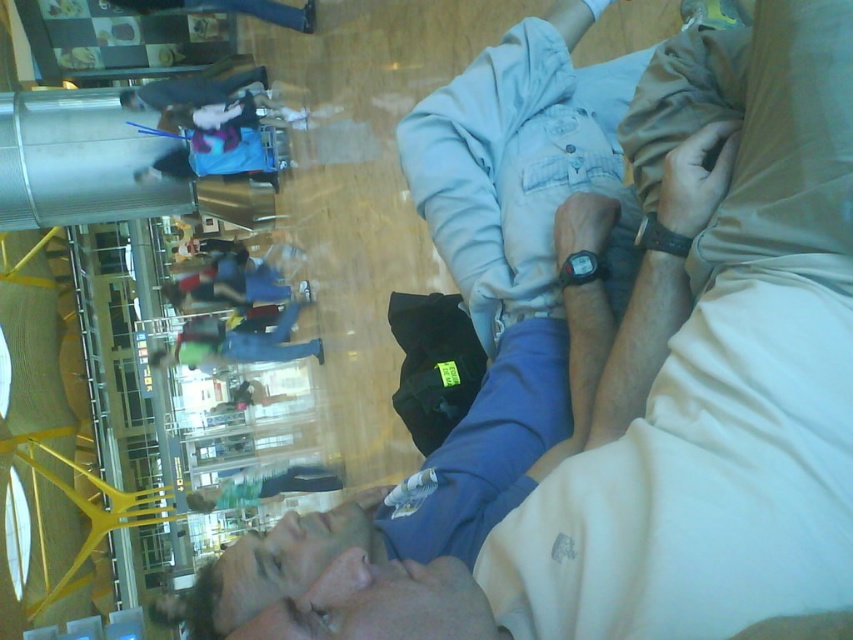
The height and width of the screenshot is (640, 853). What do you see at coordinates (689, 387) in the screenshot?
I see `light blue fabric at center` at bounding box center [689, 387].

Which is more to the left, light blue fabric at center or black leather watch at center?

Positioned to the left is light blue fabric at center.

At what (x,y) coordinates should I click in order to perform the action: click on light blue fabric at center. Please return your answer as a coordinate pair (x, y). Looking at the image, I should click on click(x=689, y=387).

Is point (682, 250) behind point (595, 252)?

No, it is in front of (595, 252).

Looking at this image, is black leather watch at center to the left of black plastic watch at center from the viewer's perspective?

Incorrect, black leather watch at center is not on the left side of black plastic watch at center.

Measure the distance between point (664,236) and camera.

They are 1.07 meters apart.

Locate an element on the screen. black leather watch at center is located at coordinates (660, 237).

Consider the image. Does light blue fabric at center appear under black plastic watch at center?

Yes.

Does point (804, 301) lie in front of point (590, 278)?

Yes, point (804, 301) is closer to viewer.

The height and width of the screenshot is (640, 853). Describe the element at coordinates (689, 387) in the screenshot. I see `light blue fabric at center` at that location.

Where is `light blue fabric at center`? light blue fabric at center is located at coordinates (689, 387).